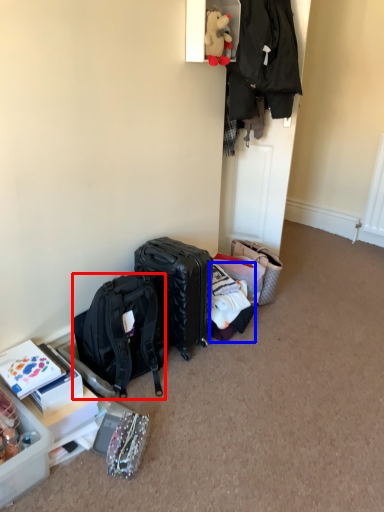
Question: Which of the following is the farthest to the observer, backpack (highlighted by a red box) or clothing (highlighted by a blue box)?

Choices:
 (A) backpack
 (B) clothing

Answer: (B)